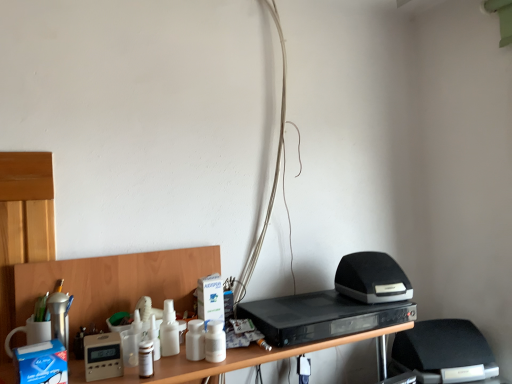
Question: Would you say black plastic dvd player at center is a long distance from black fabric computer chair at lower right?

Choices:
 (A) yes
 (B) no

Answer: (B)

Question: Can you confirm if black plastic dvd player at center is positioned to the left of black fabric computer chair at lower right?

Choices:
 (A) yes
 (B) no

Answer: (A)

Question: Would you say black plastic dvd player at center contains black fabric computer chair at lower right?

Choices:
 (A) yes
 (B) no

Answer: (B)

Question: From a real-world perspective, is black plastic dvd player at center over black fabric computer chair at lower right?

Choices:
 (A) no
 (B) yes

Answer: (B)

Question: Is black plastic dvd player at center positioned before black fabric computer chair at lower right?

Choices:
 (A) yes
 (B) no

Answer: (A)

Question: Is black plastic dvd player at center facing away from black fabric computer chair at lower right?

Choices:
 (A) yes
 (B) no

Answer: (B)

Question: Can you confirm if white matte wires at center is taller than black matte speaker at right, which appears as the second appliance when viewed from the left?

Choices:
 (A) yes
 (B) no

Answer: (A)

Question: Is black matte speaker at right, which appears as the 1th appliance when viewed from the back, completely or partially inside white matte wires at center?

Choices:
 (A) no
 (B) yes

Answer: (A)

Question: Considering the relative positions of white matte wires at center and black matte speaker at right, which is the second appliance from bottom to top, in the image provided, is white matte wires at center behind black matte speaker at right, which is the second appliance from bottom to top,?

Choices:
 (A) no
 (B) yes

Answer: (B)

Question: From a real-world perspective, is white matte wires at center physically below black matte speaker at right, which appears as the second appliance when viewed from the left?

Choices:
 (A) yes
 (B) no

Answer: (B)

Question: Can you confirm if white matte wires at center is smaller than black matte speaker at right, the first appliance viewed from the top?

Choices:
 (A) no
 (B) yes

Answer: (A)

Question: Would you say white matte wires at center is outside black matte speaker at right, which ranks as the 1th appliance in right-to-left order?

Choices:
 (A) yes
 (B) no

Answer: (A)

Question: Is beige plastic thermostat at lower left, the 2th appliance positioned from the back, outside of black matte speaker at right, which ranks as the 1th appliance in right-to-left order?

Choices:
 (A) yes
 (B) no

Answer: (A)